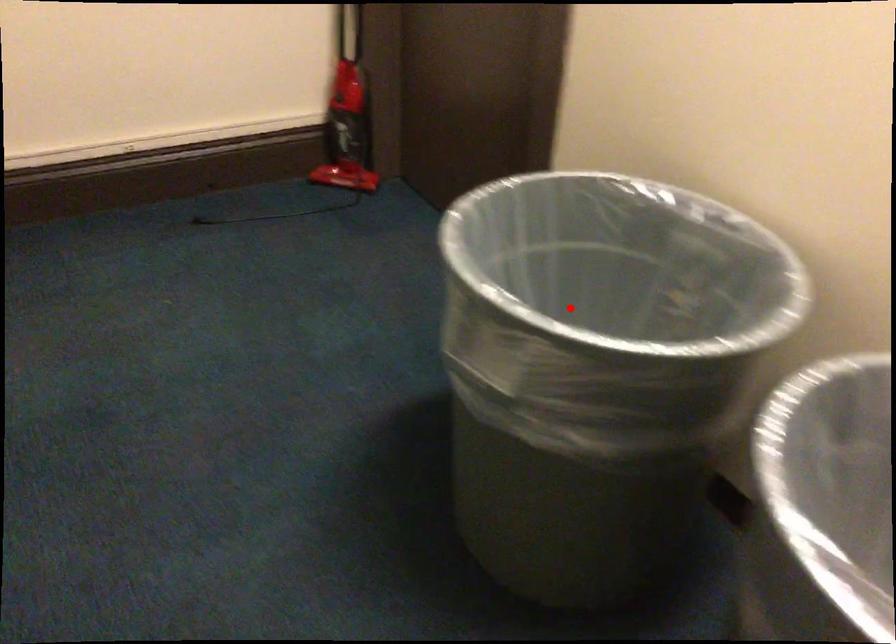
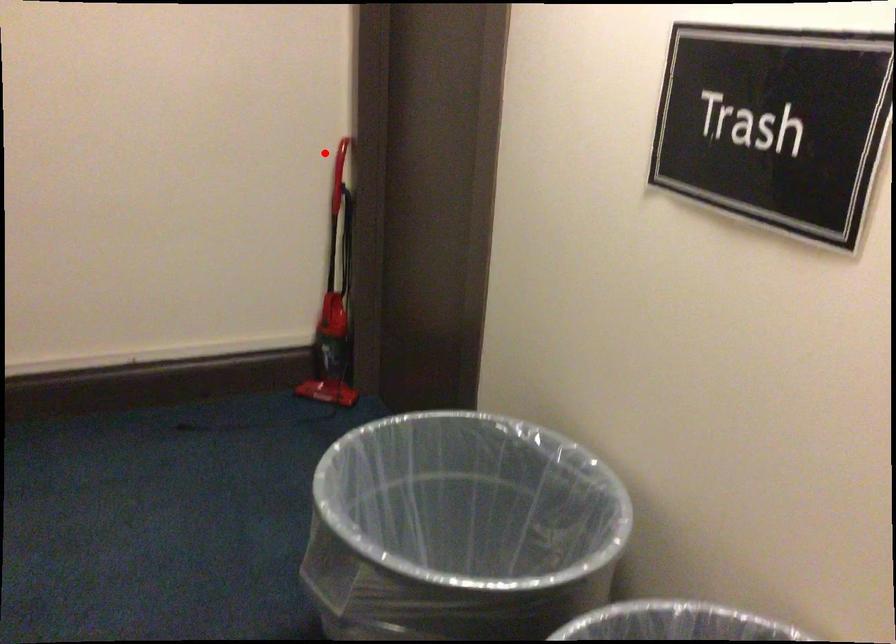
I am providing you with two images of the same scene from different viewpoints. A red point is marked on the first image and another point is marked on the second image. Does the point marked in image1 correspond to the same location as the one in image2?

No